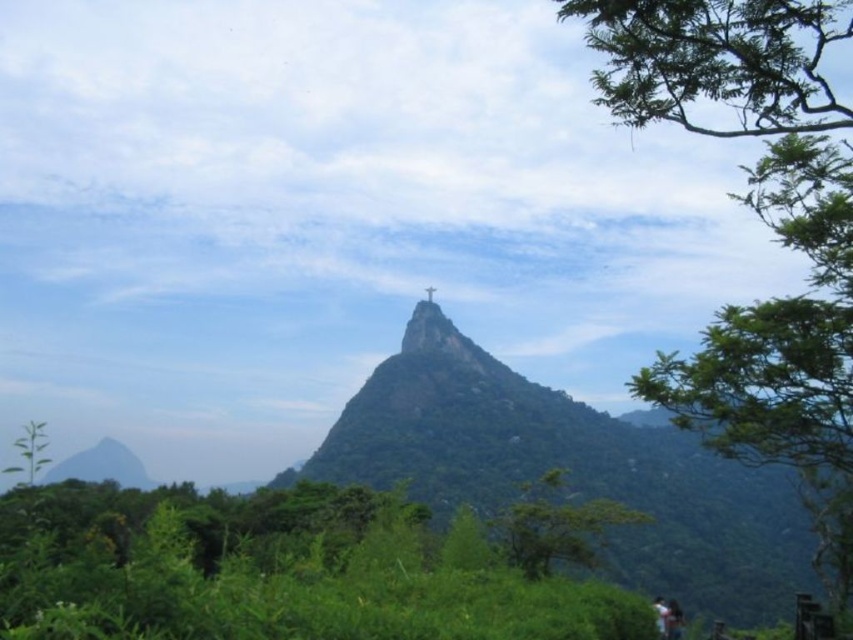
Question: Is green leafy tree at upper right wider than green rocky hill at center?

Choices:
 (A) yes
 (B) no

Answer: (B)

Question: Is light brown wooden bench at lower right further to the viewer compared to white fabric person at center?

Choices:
 (A) no
 (B) yes

Answer: (B)

Question: Among these objects, which one is nearest to the camera?

Choices:
 (A) green leafy tree at upper right
 (B) green rocky hill at center

Answer: (A)

Question: Which object appears closest to the camera in this image?

Choices:
 (A) light brown wooden bench at lower right
 (B) green rocky hill at center
 (C) green leafy tree at upper right
 (D) metallic statue at center

Answer: (C)

Question: Which of the following is the farthest from the observer?

Choices:
 (A) green leafy tree at upper right
 (B) white fabric person at center

Answer: (B)

Question: Is green leafy tree at upper right to the right of light brown wooden bench at lower right from the viewer's perspective?

Choices:
 (A) yes
 (B) no

Answer: (A)